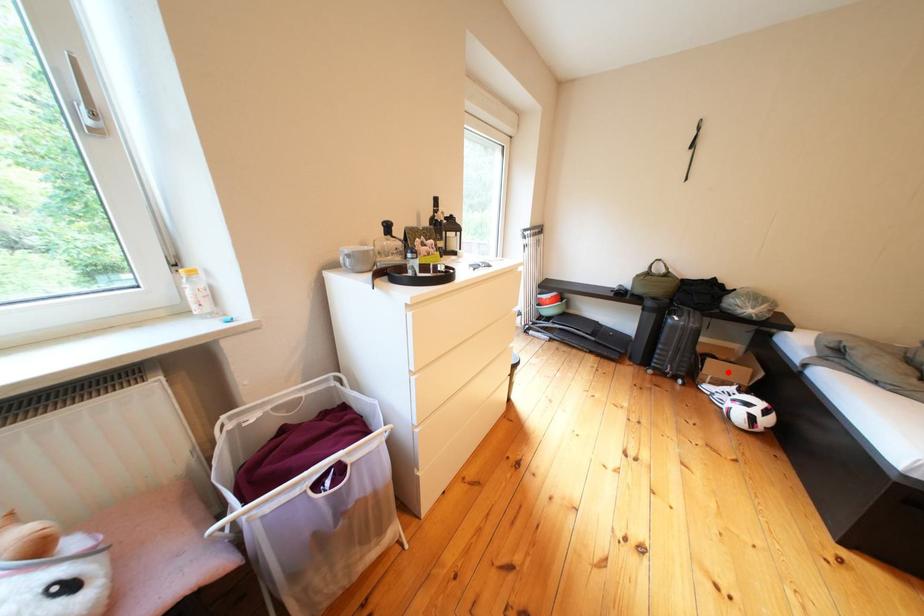
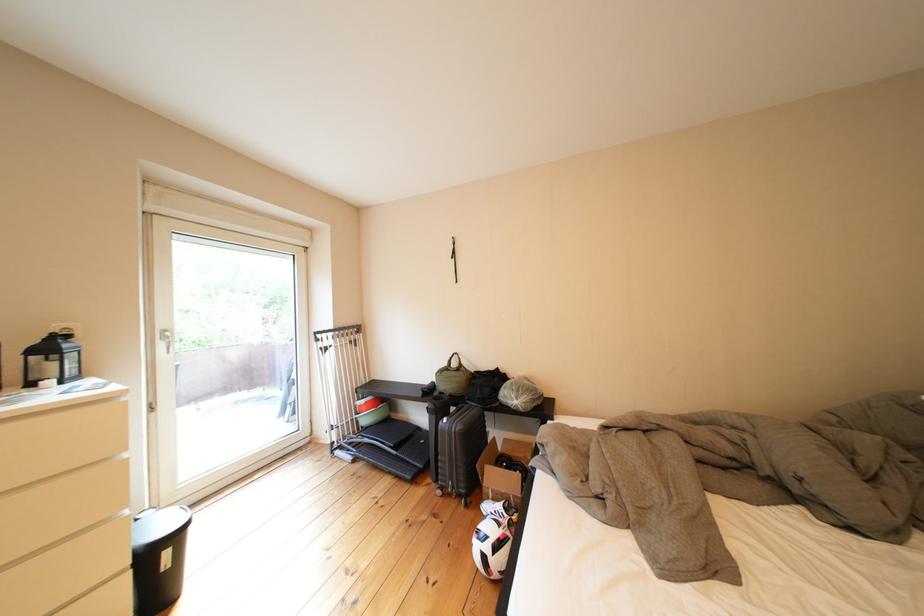
The point at the highlighted location is marked in the first image. Where is the corresponding point in the second image?

(505, 480)